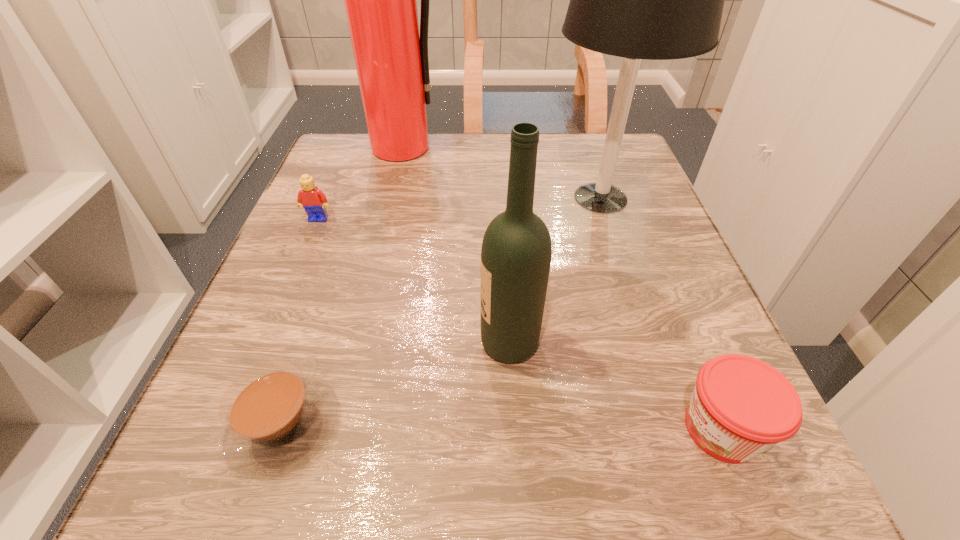
Find the location of a particular element. blank space located on the labeled side of the third nearest object is located at coordinates (313, 343).

You are a GUI agent. You are given a task and a screenshot of the screen. Output one action in this format:
    pyautogui.click(x=<x>, y=<y>)
    Task: Click on the vacant space located 0.130m on the labeled side of the third nearest object
    
    Given the screenshot: What is the action you would take?
    pyautogui.click(x=390, y=343)

In order to click on vacant region located on the front-facing side of the Lego in this screenshot , I will do `click(287, 294)`.

Identify the location of free space located 0.330m on the label side of the jam. (408, 429).

In order to click on free space located 0.060m on the label side of the jam in this screenshot , I will do `click(629, 429)`.

This screenshot has height=540, width=960. I want to click on free spot located on the label side of the jam, so click(417, 429).

Where is `vacant space located on the right of the shortest object`? Image resolution: width=960 pixels, height=540 pixels. vacant space located on the right of the shortest object is located at coordinates (388, 426).

Where is `fire extinguisher that is at the far edge`? This screenshot has height=540, width=960. fire extinguisher that is at the far edge is located at coordinates (391, 58).

Find the location of `table lamp at the far edge`. table lamp at the far edge is located at coordinates (657, 0).

Locate an element on the screen. jam situated at the near edge is located at coordinates (741, 406).